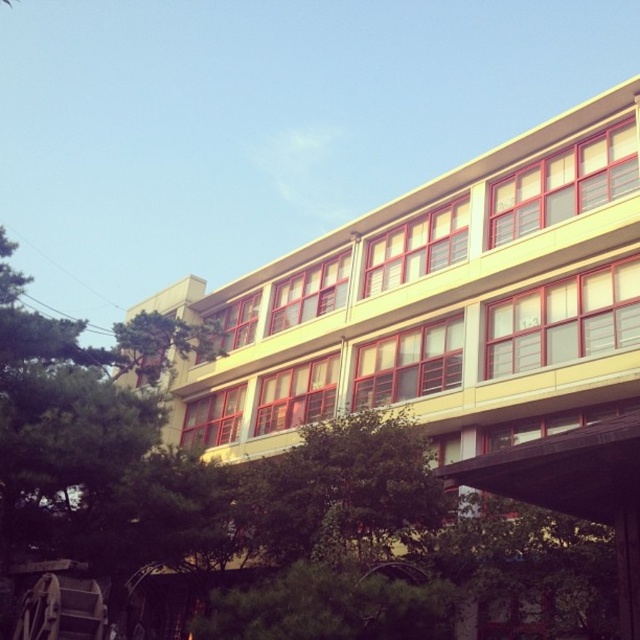
Does yellow matte building at center have a lesser height compared to green leafy tree at center?

No, yellow matte building at center is not shorter than green leafy tree at center.

Who is shorter, yellow matte building at center or green leafy tree at center?

Standing shorter between the two is green leafy tree at center.

Describe the element at coordinates (456, 326) in the screenshot. This screenshot has height=640, width=640. I see `yellow matte building at center` at that location.

You are a GUI agent. You are given a task and a screenshot of the screen. Output one action in this format:
    pyautogui.click(x=<x>, y=<y>)
    Task: Click on the yellow matte building at center
    
    Given the screenshot: What is the action you would take?
    pyautogui.click(x=456, y=326)